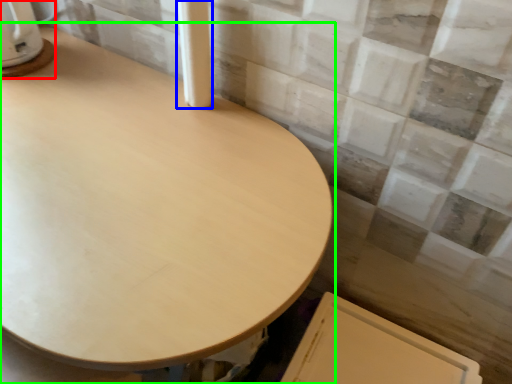
Question: Which object is the farthest from appliance (highlighted by a red box)? Choose among these: pillar (highlighted by a blue box) or table (highlighted by a green box).

Choices:
 (A) pillar
 (B) table

Answer: (B)